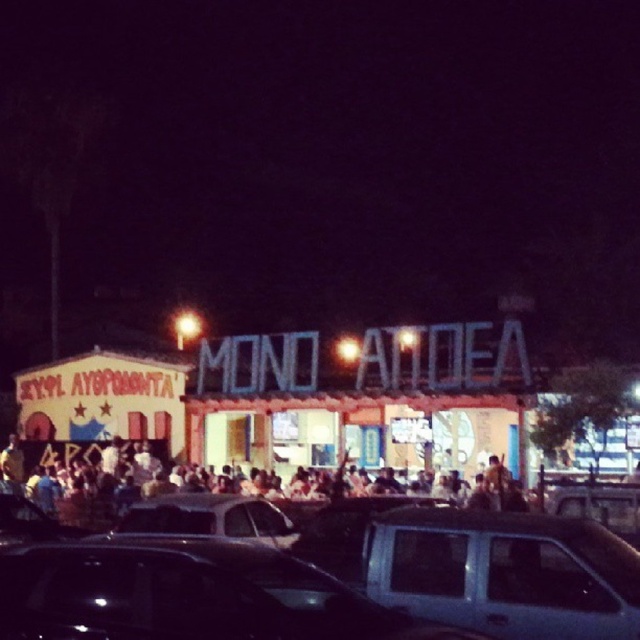
Question: Among these objects, which one is farthest from the camera?

Choices:
 (A) metallic silver car at center
 (B) shiny silver sedan at center
 (C) multicolored fabric crowd at center

Answer: (C)

Question: Which object appears farthest from the camera in this image?

Choices:
 (A) metallic gray sedan at lower right
 (B) multicolored fabric crowd at center
 (C) metallic silver car at center

Answer: (B)

Question: Is metallic gray sedan at lower right bigger than shiny silver sedan at center?

Choices:
 (A) yes
 (B) no

Answer: (B)

Question: Among these objects, which one is farthest from the camera?

Choices:
 (A) multicolored fabric crowd at center
 (B) metallic silver car at center
 (C) metallic gray sedan at lower right
 (D) shiny silver sedan at center

Answer: (A)

Question: Is multicolored fabric crowd at center in front of shiny silver sedan at center?

Choices:
 (A) no
 (B) yes

Answer: (A)

Question: From the image, what is the correct spatial relationship of metallic gray sedan at lower right in relation to shiny silver sedan at center?

Choices:
 (A) above
 (B) below

Answer: (A)